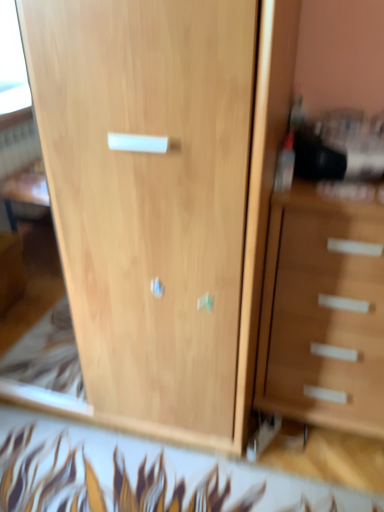
This screenshot has width=384, height=512. What are the coordinates of `free space in front of wooden chest of drawers at right` in the screenshot? It's located at (313, 474).